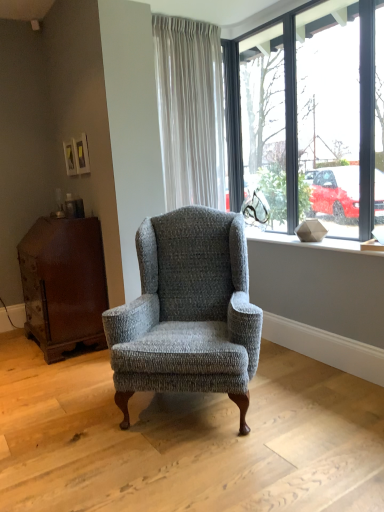
Question: From a real-world perspective, does clear glass window at upper right sit lower than matte gray stone at upper right?

Choices:
 (A) yes
 (B) no

Answer: (B)

Question: Is clear glass window at upper right facing away from matte gray stone at upper right?

Choices:
 (A) no
 (B) yes

Answer: (A)

Question: Is clear glass window at upper right closer to the viewer compared to matte gray stone at upper right?

Choices:
 (A) yes
 (B) no

Answer: (A)

Question: Is clear glass window at upper right further to camera compared to matte gray stone at upper right?

Choices:
 (A) yes
 (B) no

Answer: (B)

Question: Is clear glass window at upper right placed right next to matte gray stone at upper right?

Choices:
 (A) no
 (B) yes

Answer: (A)

Question: Does clear glass window at upper right have a greater width compared to matte gray stone at upper right?

Choices:
 (A) yes
 (B) no

Answer: (B)

Question: Does clear glass window at upper right have a smaller size compared to white textured curtain at upper center?

Choices:
 (A) no
 (B) yes

Answer: (A)

Question: Considering the relative sizes of clear glass window at upper right and white textured curtain at upper center in the image provided, is clear glass window at upper right bigger than white textured curtain at upper center?

Choices:
 (A) no
 (B) yes

Answer: (B)

Question: Is clear glass window at upper right thinner than white textured curtain at upper center?

Choices:
 (A) no
 (B) yes

Answer: (B)

Question: Is the depth of clear glass window at upper right greater than that of white textured curtain at upper center?

Choices:
 (A) yes
 (B) no

Answer: (B)

Question: Would you consider clear glass window at upper right to be distant from white textured curtain at upper center?

Choices:
 (A) no
 (B) yes

Answer: (A)

Question: Is clear glass window at upper right in front of white textured curtain at upper center?

Choices:
 (A) no
 (B) yes

Answer: (B)

Question: Considering the relative sizes of textured gray wingback chair at center and dark brown wood dresser at left in the image provided, is textured gray wingback chair at center smaller than dark brown wood dresser at left?

Choices:
 (A) yes
 (B) no

Answer: (B)